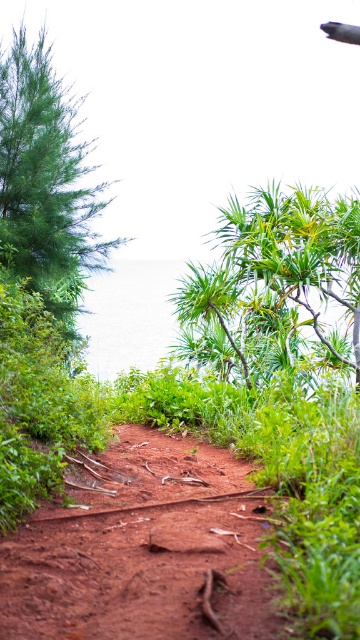
Between point (177, 554) and point (244, 291), which one is positioned in front?

Positioned in front is point (177, 554).

What do you see at coordinates (144, 548) in the screenshot?
I see `dusty red dirt track at center` at bounding box center [144, 548].

Is point (254, 538) farther from camera compared to point (241, 333)?

No, it is in front of (241, 333).

Identify the location of dusty red dirt track at center. (144, 548).

Based on the photo, between green leafy plant at center and green matte tree at left, which one appears on the left side from the viewer's perspective?

green matte tree at left is more to the left.

Locate an element on the screen. The width and height of the screenshot is (360, 640). green leafy plant at center is located at coordinates (276, 282).

Locate an element on the screen. green leafy plant at center is located at coordinates coord(276,282).

Is dusty red dirt track at center taller than green matte tree at left?

No, dusty red dirt track at center is not taller than green matte tree at left.

Identify the location of dusty red dirt track at center. The width and height of the screenshot is (360, 640). (144, 548).

Who is more distant from viewer, (x=185, y=497) or (x=36, y=51)?

The point (x=36, y=51) is more distant.

Where is `dusty red dirt track at center`? The width and height of the screenshot is (360, 640). dusty red dirt track at center is located at coordinates click(x=144, y=548).